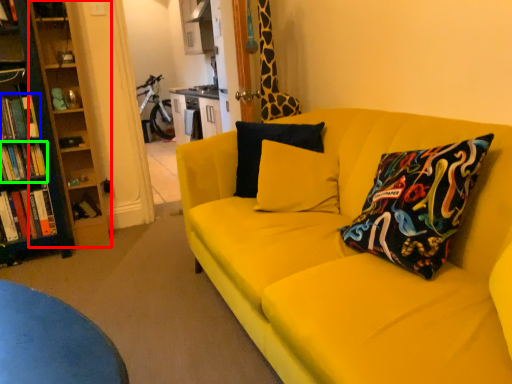
Question: Which object is the farthest from bookshelf (highlighted by a red box)? Choose among these: book (highlighted by a blue box) or book (highlighted by a green box).

Choices:
 (A) book
 (B) book

Answer: (B)